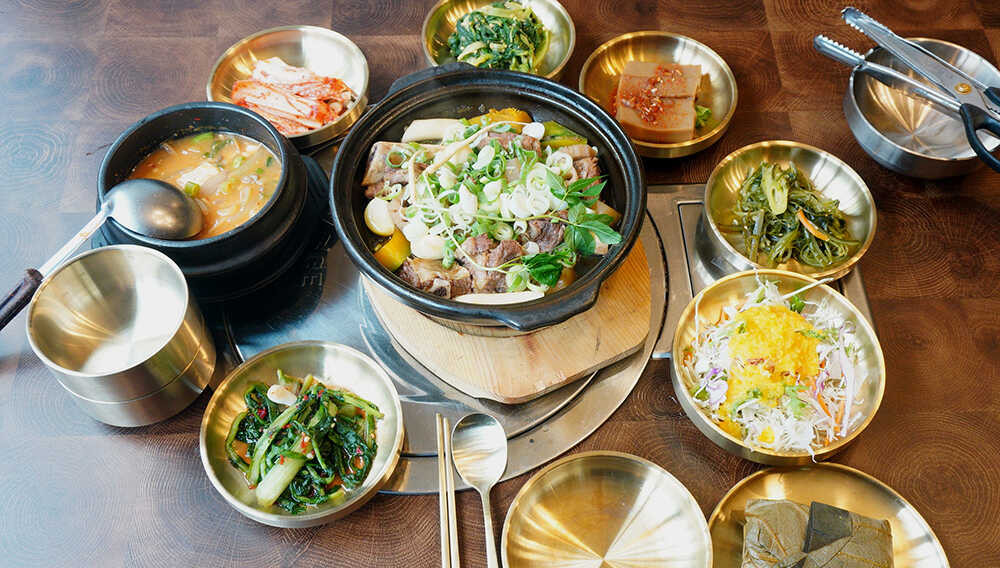
The height and width of the screenshot is (568, 1000). I want to click on spoon, so click(x=487, y=469).